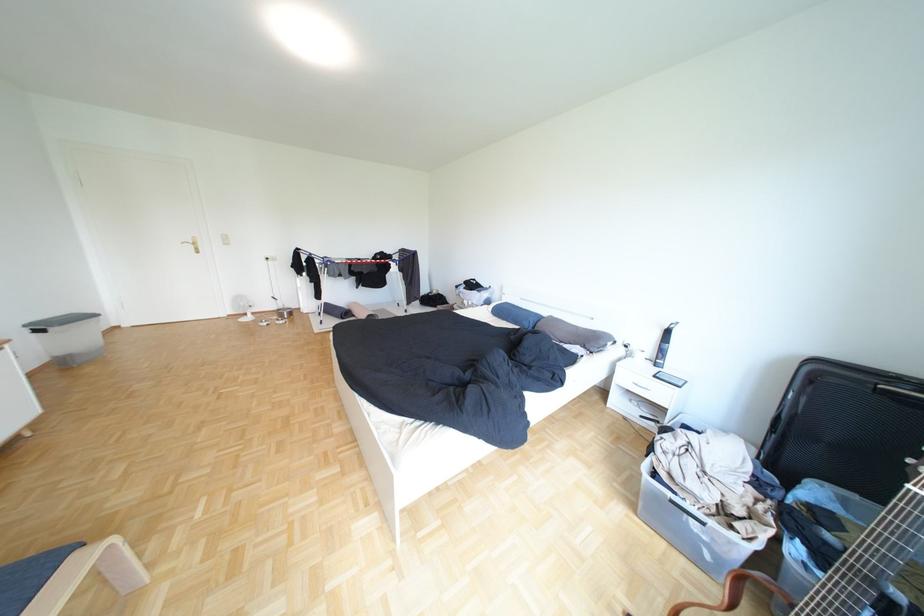
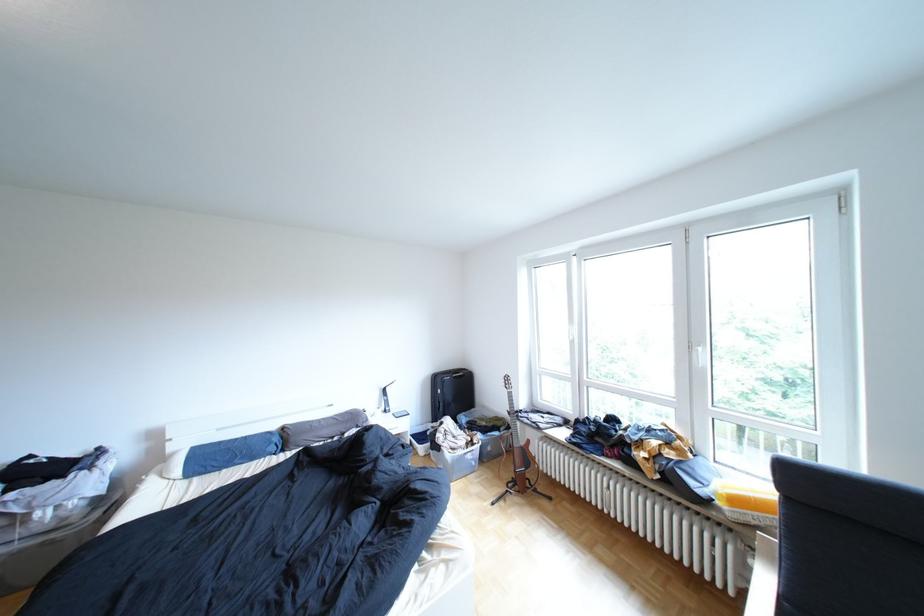
Locate, in the second image, the point that corresponds to (x=505, y=310) in the first image.

(193, 472)